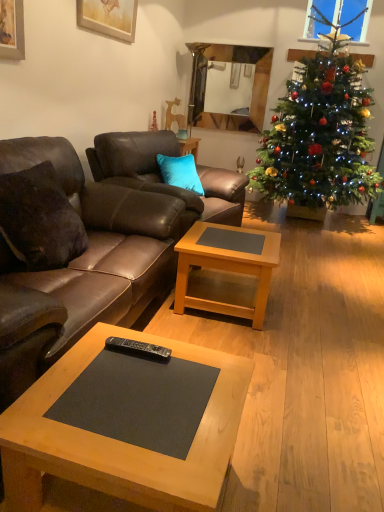
Where is `vacant space to the right of black plastic remote control at center`? vacant space to the right of black plastic remote control at center is located at coordinates (184, 362).